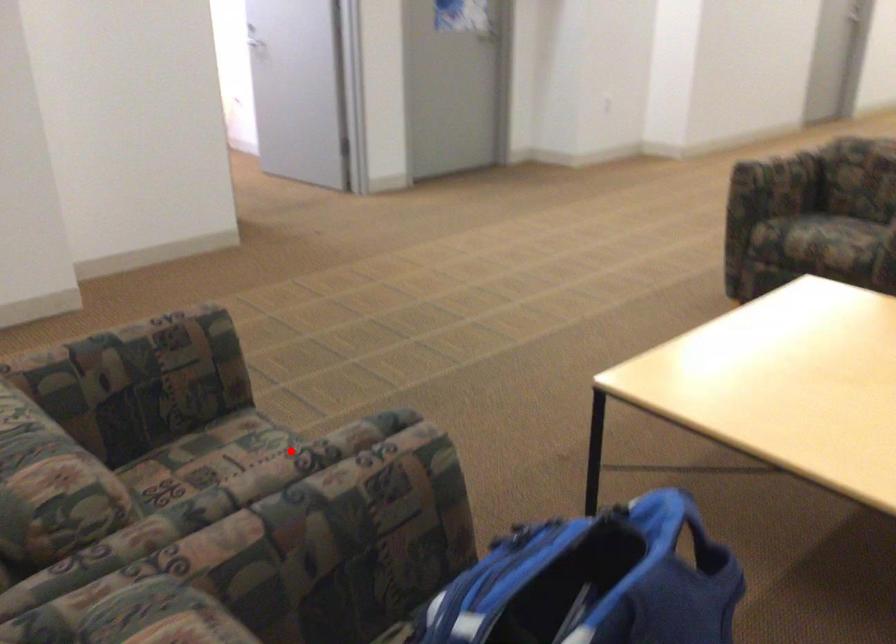
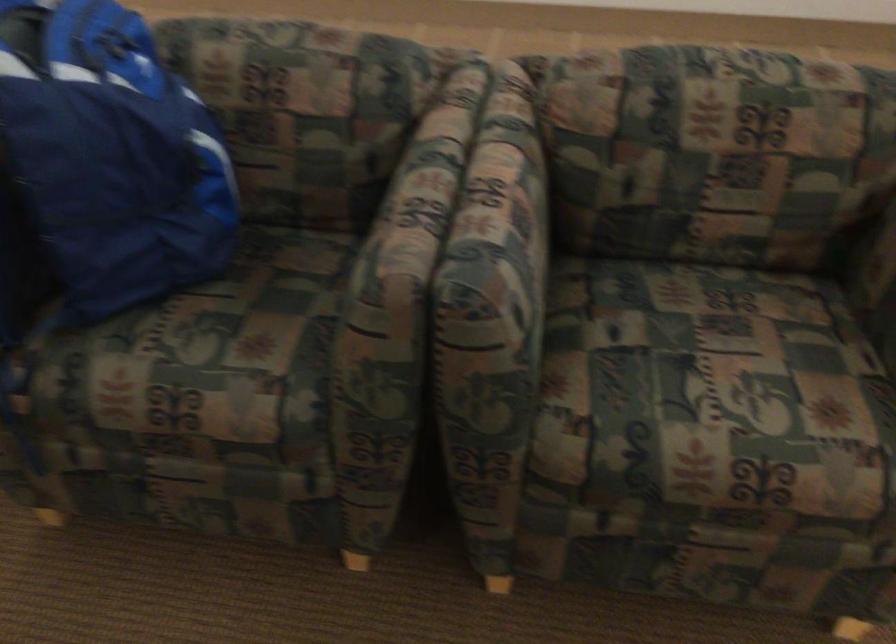
The point at the highlighted location is marked in the first image. Where is the corresponding point in the second image?

(510, 196)